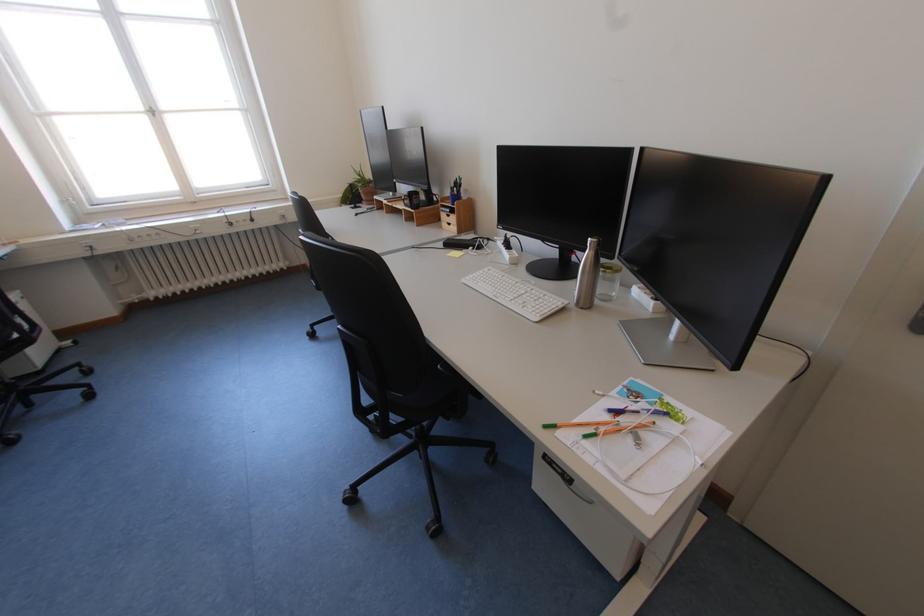
The location [608,281] corresponds to which object?

This point indicates the glass jar.